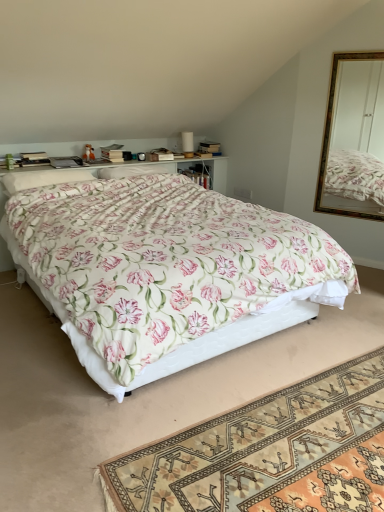
Question: From a real-world perspective, is floral fabric bed at center physically below matte brown box at upper center?

Choices:
 (A) yes
 (B) no

Answer: (A)

Question: Are floral fabric bed at center and matte brown box at upper center located far from each other?

Choices:
 (A) yes
 (B) no

Answer: (A)

Question: Is floral fabric bed at center next to matte brown box at upper center?

Choices:
 (A) yes
 (B) no

Answer: (B)

Question: Does floral fabric bed at center have a lesser height compared to matte brown box at upper center?

Choices:
 (A) yes
 (B) no

Answer: (B)

Question: From the image's perspective, does floral fabric bed at center appear higher than matte brown box at upper center?

Choices:
 (A) no
 (B) yes

Answer: (A)

Question: Would you say floral fabric bed at center is outside matte brown box at upper center?

Choices:
 (A) no
 (B) yes

Answer: (B)

Question: Is white soft pillow at upper left, placed as the second pillow when sorted from right to left, completely or partially outside of floral fabric rug at lower center?

Choices:
 (A) yes
 (B) no

Answer: (A)

Question: From the image's perspective, is white soft pillow at upper left, placed as the second pillow when sorted from right to left, located above floral fabric rug at lower center?

Choices:
 (A) no
 (B) yes

Answer: (B)

Question: Can you confirm if white soft pillow at upper left, placed as the second pillow when sorted from right to left, is wider than floral fabric rug at lower center?

Choices:
 (A) yes
 (B) no

Answer: (B)

Question: From the image's perspective, is white soft pillow at upper left, the 1th pillow when ordered from front to back, located beneath floral fabric rug at lower center?

Choices:
 (A) no
 (B) yes

Answer: (A)

Question: Is white soft pillow at upper left, placed as the second pillow when sorted from right to left, to the right of floral fabric rug at lower center from the viewer's perspective?

Choices:
 (A) yes
 (B) no

Answer: (B)

Question: Is white soft pillow at upper left, which is the 2th pillow in back-to-front order, oriented towards floral fabric rug at lower center?

Choices:
 (A) yes
 (B) no

Answer: (B)

Question: Is floral fabric rug at lower center in front of hardcover book at upper left?

Choices:
 (A) no
 (B) yes

Answer: (B)